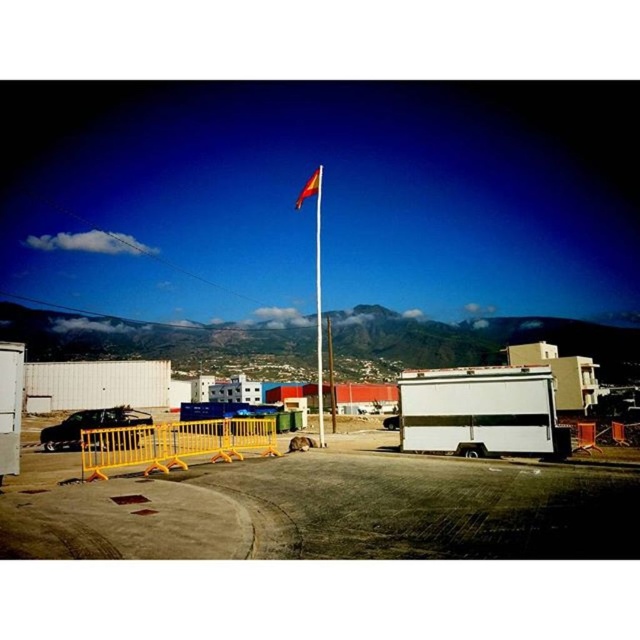
Question: Is metallic flag pole at center to the left of red fabric flag at upper center from the viewer's perspective?

Choices:
 (A) no
 (B) yes

Answer: (B)

Question: Considering the relative positions of yellow plastic barricade at lower left and metallic flag pole at center in the image provided, where is yellow plastic barricade at lower left located with respect to metallic flag pole at center?

Choices:
 (A) below
 (B) above

Answer: (A)

Question: Which is farther from the yellow plastic barricade at lower left?

Choices:
 (A) red fabric flag at upper center
 (B) metallic flag pole at center

Answer: (B)

Question: Which object is the farthest from the yellow plastic barricade at lower left?

Choices:
 (A) metallic flag pole at center
 (B) red fabric flag at upper center

Answer: (A)

Question: Which object is the closest to the red fabric flag at upper center?

Choices:
 (A) yellow plastic barricade at lower left
 (B) metallic flag pole at center

Answer: (B)

Question: Does yellow plastic barricade at lower left have a lesser width compared to red fabric flag at upper center?

Choices:
 (A) yes
 (B) no

Answer: (B)